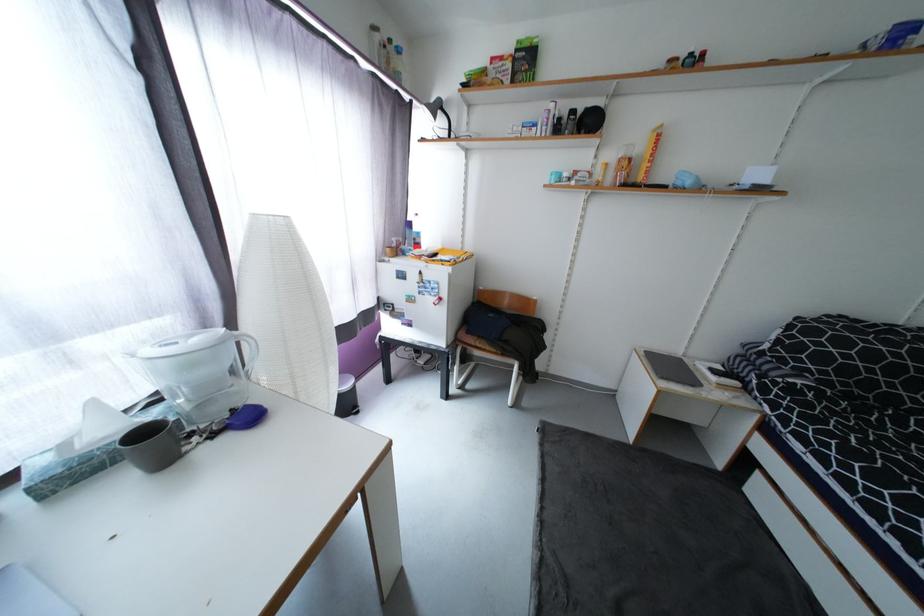
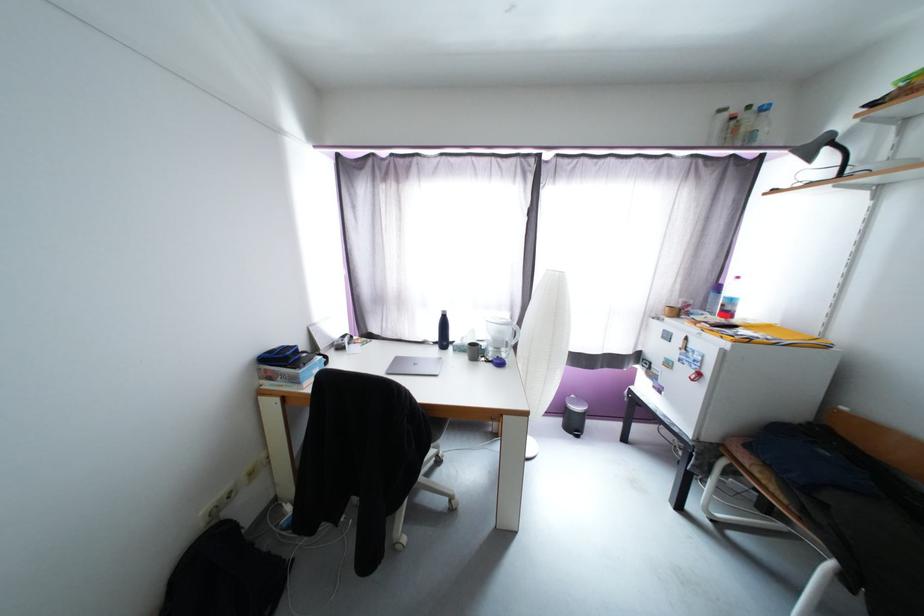
Question: How did the camera likely rotate?

Choices:
 (A) Left
 (B) Right
 (C) Up
 (D) Down

Answer: (A)